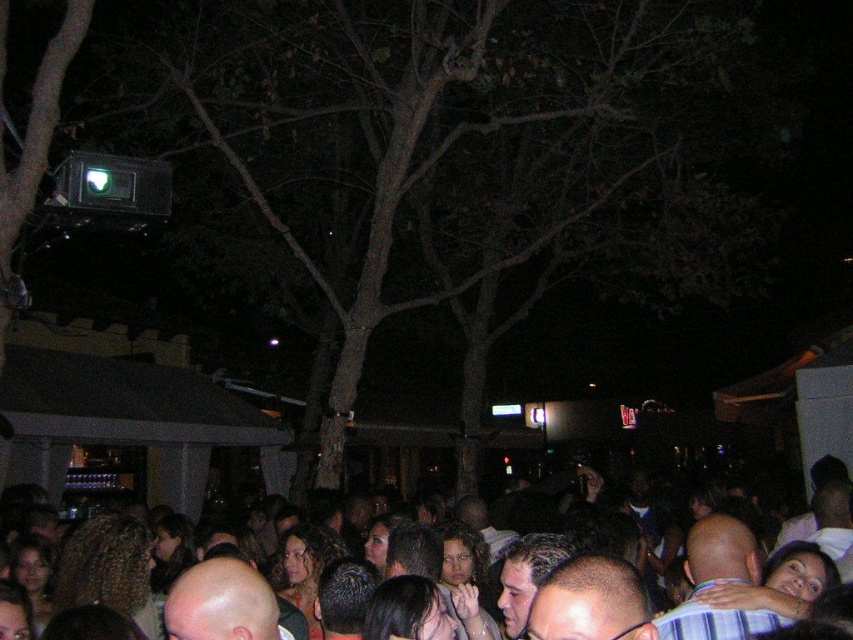
You are a photographer trying to capture a clear shot of the shiny bald head at center without the brown bark tree at upper center blocking it. Since the tree is shorter than the head, can you angle your camera downward to avoid the tree?

The brown bark tree at upper center is shorter than the shiny bald head at center, so angling the camera downward might still allow you to capture the shiny bald head at center without the tree blocking it, as the tree is lower in height.